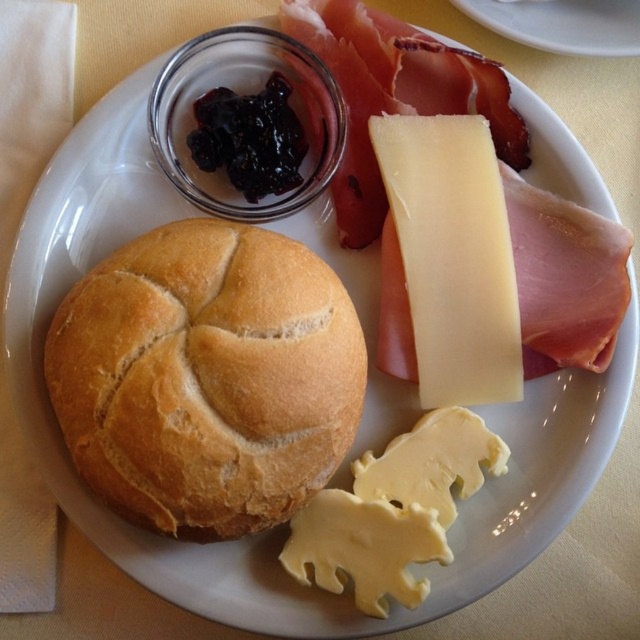
You are a chef preparing a dish and need to place the white smooth cheese at upper right on a plate that is 25 inches in diameter. Can you fit the cheese on the plate without overlapping the edge?

The white smooth cheese at upper right is 30.57 inches in diameter, which is larger than the plate. Therefore, it cannot be placed on the plate without overlapping the edge.

What are the coordinates of the golden brown crusty loaf at center?

The golden brown crusty loaf at center is located at coordinates point (205, 378).

You are a food stylist arranging this plate. You need to place a new garnish that must be smaller than both the golden brown crusty loaf at center and the yellowish smooth cheese at lower center. Which of the two items can the garnish be placed next to without overlapping?

The garnish can be placed next to the yellowish smooth cheese at lower center because it is smaller than the golden brown crusty loaf at center.